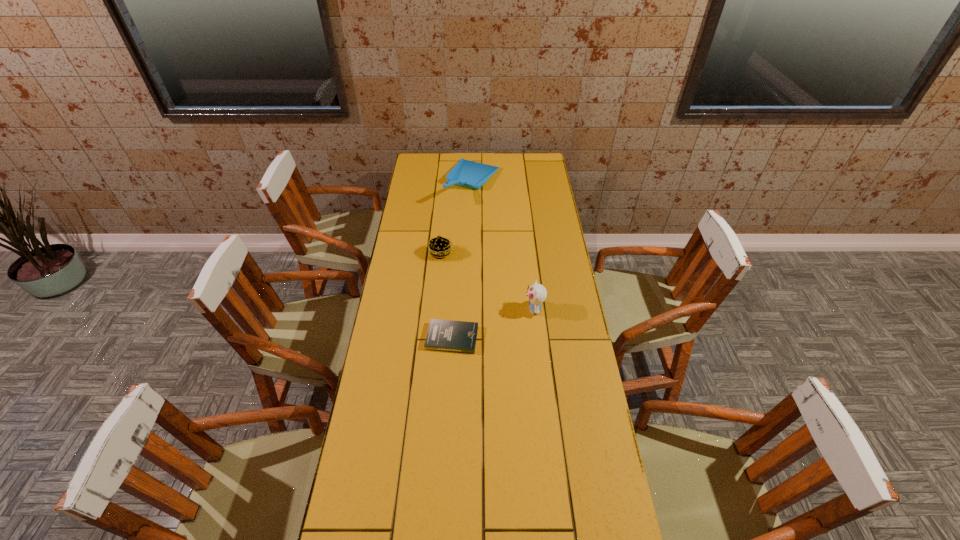
At what (x,y) coordinates should I click in order to perform the action: click on free space at the far right corner of the desktop. Please return your answer as a coordinate pair (x, y). The width and height of the screenshot is (960, 540). Looking at the image, I should click on pyautogui.click(x=529, y=175).

What are the coordinates of `free spot between the rightmost object and the third tallest object` in the screenshot? It's located at (488, 281).

Identify the location of vacant area that lies between the book and the second farthest object. (446, 296).

The width and height of the screenshot is (960, 540). Find the location of `free area in between the patty and the dustpan`. free area in between the patty and the dustpan is located at coordinates (457, 218).

This screenshot has height=540, width=960. Find the location of `vacant region between the third farthest object and the nearest object`. vacant region between the third farthest object and the nearest object is located at coordinates (493, 323).

Locate an element on the screen. This screenshot has height=540, width=960. vacant area that lies between the patty and the farthest object is located at coordinates (457, 218).

Find the location of a particular element. blank region between the farthest object and the patty is located at coordinates (457, 218).

You are a GUI agent. You are given a task and a screenshot of the screen. Output one action in this format:
    pyautogui.click(x=<x>, y=<y>)
    Task: Click on the vacant region between the kitten and the dustpan
    Image resolution: width=960 pixels, height=540 pixels.
    Given the screenshot: What is the action you would take?
    (504, 246)

Where is `vacant space in between the farthest object and the rightmost object`? vacant space in between the farthest object and the rightmost object is located at coordinates pyautogui.click(x=504, y=246).

Identify the location of empty space that is in between the farthest object and the shortest object. Image resolution: width=960 pixels, height=540 pixels. (463, 260).